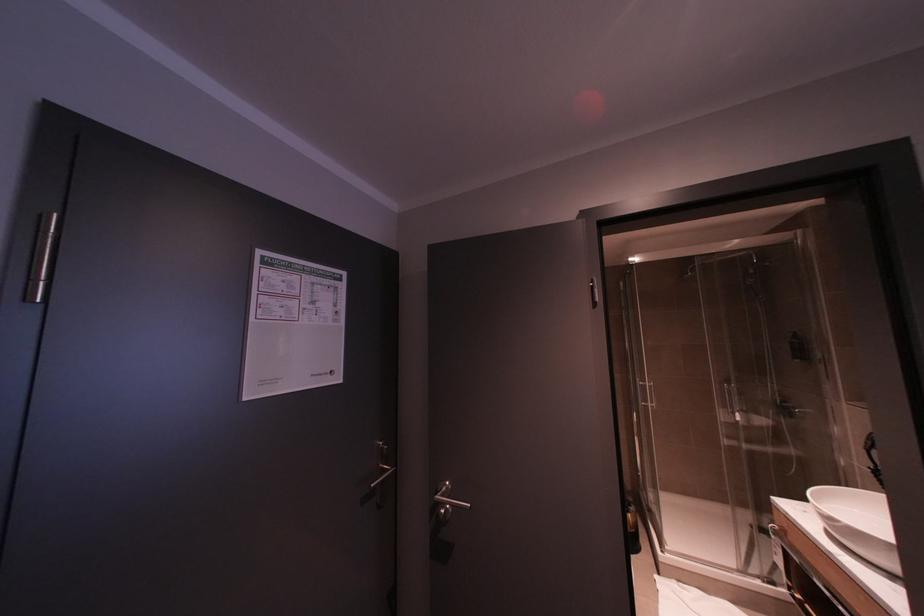
The width and height of the screenshot is (924, 616). I want to click on shower door handle, so click(x=637, y=392).